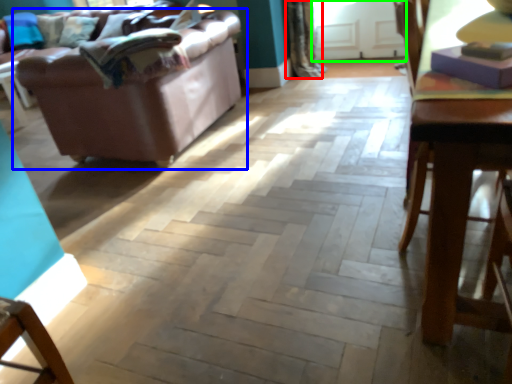
Question: Considering the real-world distances, which object is closest to curtain (highlighted by a red box)? studio couch (highlighted by a blue box) or glass door (highlighted by a green box).

Choices:
 (A) studio couch
 (B) glass door

Answer: (B)